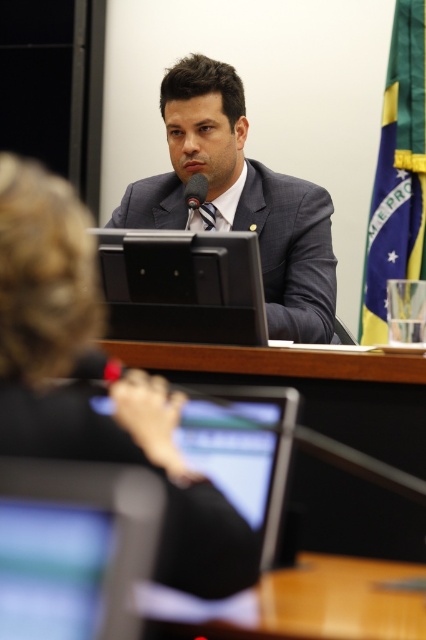
Question: Which object appears farthest from the camera in this image?

Choices:
 (A) wooden table at center
 (B) black matte microphone at center

Answer: (B)

Question: Based on their relative distances, which object is farther from the black plastic laptop at center?

Choices:
 (A) black matte microphone at center
 (B) matte black suit at center
 (C) black fabric jacket at upper center

Answer: (C)

Question: Can you confirm if black fabric jacket at upper center is positioned below black plastic laptop at center?

Choices:
 (A) no
 (B) yes

Answer: (B)

Question: Does matte black suit at center appear over black plastic laptop at center?

Choices:
 (A) no
 (B) yes

Answer: (B)

Question: Based on their relative distances, which object is nearer to the wooden table at center?

Choices:
 (A) matte black monitor at lower left
 (B) black matte microphone at center

Answer: (A)

Question: Is black fabric jacket at upper center smaller than matte black suit at center?

Choices:
 (A) yes
 (B) no

Answer: (A)